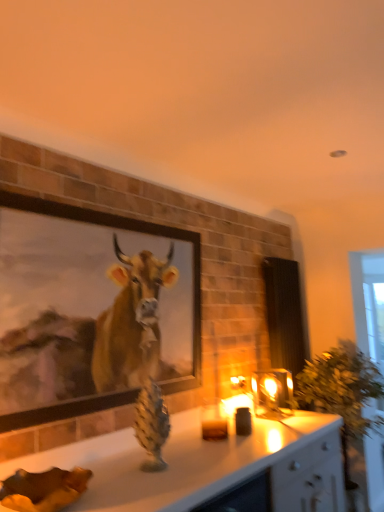
You are a GUI agent. You are given a task and a screenshot of the screen. Output one action in this format:
    pyautogui.click(x=<x>, y=<y>)
    Task: Click on the wooden framed painting at upper left
    The height and width of the screenshot is (512, 384).
    Given the screenshot: What is the action you would take?
    pyautogui.click(x=91, y=310)

Where is `green leafy plant at right`? This screenshot has height=512, width=384. green leafy plant at right is located at coordinates (342, 387).

Image resolution: width=384 pixels, height=512 pixels. What do you see at coordinates (342, 387) in the screenshot?
I see `green leafy plant at right` at bounding box center [342, 387].

This screenshot has height=512, width=384. Describe the element at coordinates (272, 392) in the screenshot. I see `translucent glass candle at center` at that location.

At what (x,y) coordinates should I click in order to perform the action: click on wooden framed painting at upper left. Please return your answer as a coordinate pair (x, y). This screenshot has height=512, width=384. Looking at the image, I should click on (91, 310).

From the image's perspective, would you say wooden framed painting at upper left is positioned over translucent glass candle at center?

Yes, from the image's perspective, wooden framed painting at upper left is on top of translucent glass candle at center.

Can you confirm if wooden framed painting at upper left is wider than translucent glass candle at center?

No.

Is wooden framed painting at upper left located outside translucent glass candle at center?

wooden framed painting at upper left lies outside translucent glass candle at center's area.

Which of these two, green leafy plant at right or translucent glass candle at center, stands shorter?

Standing shorter between the two is translucent glass candle at center.

Between green leafy plant at right and translucent glass candle at center, which one appears on the right side from the viewer's perspective?

From the viewer's perspective, green leafy plant at right appears more on the right side.

Is green leafy plant at right far away from translucent glass candle at center?

No, green leafy plant at right is not far from translucent glass candle at center.

From a real-world perspective, is green leafy plant at right over translucent glass candle at center?

No, from a real-world perspective, green leafy plant at right is not on top of translucent glass candle at center.

Is translucent glass candle at center inside or outside of green leafy plant at right?

translucent glass candle at center is not inside green leafy plant at right, it's outside.

You are a GUI agent. You are given a task and a screenshot of the screen. Output one action in this format:
    pyautogui.click(x=<x>, y=<y>)
    Task: Click on the candle holder that is above the green leafy plant at right (from a real-world perspective)
    
    Given the screenshot: What is the action you would take?
    pyautogui.click(x=272, y=392)

From the image's perspective, who appears lower, translucent glass candle at center or green leafy plant at right?

green leafy plant at right, from the image's perspective.

Is translucent glass candle at center positioned with its back to green leafy plant at right?

A: No, green leafy plant at right is not at the back of translucent glass candle at center.

Is point (316, 398) closer to camera compared to point (173, 288)?

No, it is behind (173, 288).

Is green leafy plant at right positioned far away from wooden framed painting at upper left?

Yes, green leafy plant at right and wooden framed painting at upper left are quite far apart.

Is green leafy plant at right inside or outside of wooden framed painting at upper left?

green leafy plant at right is located beyond the bounds of wooden framed painting at upper left.

Is green leafy plant at right closer to camera compared to wooden framed painting at upper left?

No, green leafy plant at right is further to the viewer.

Which object is further away from the camera taking this photo, translucent glass candle at center or wooden framed painting at upper left?

translucent glass candle at center is further away from the camera.

Which object is positioned more to the left, translucent glass candle at center or wooden framed painting at upper left?

wooden framed painting at upper left.

From the image's perspective, between translucent glass candle at center and wooden framed painting at upper left, which one is located above?

wooden framed painting at upper left.

Considering the positions of objects wooden framed painting at upper left and green leafy plant at right in the image provided, who is more to the left, wooden framed painting at upper left or green leafy plant at right?

Positioned to the left is wooden framed painting at upper left.

How distant is wooden framed painting at upper left from green leafy plant at right?

wooden framed painting at upper left and green leafy plant at right are 1.55 meters apart.

From the image's perspective, is wooden framed painting at upper left above or below green leafy plant at right?

Clearly, from the image's perspective, wooden framed painting at upper left is above green leafy plant at right.

Based on their sizes in the image, would you say wooden framed painting at upper left is bigger or smaller than green leafy plant at right?

Clearly, wooden framed painting at upper left is smaller in size than green leafy plant at right.

Find the location of a particular element. The image size is (384, 512). candle holder below the wooden framed painting at upper left (from a real-world perspective) is located at coordinates (272, 392).

You are a GUI agent. You are given a task and a screenshot of the screen. Output one action in this format:
    pyautogui.click(x=<x>, y=<y>)
    Task: Click on the plant located on the right of translucent glass candle at center
    This screenshot has width=384, height=512.
    Given the screenshot: What is the action you would take?
    pyautogui.click(x=342, y=387)

When comparing their distances from green leafy plant at right, does translucent glass candle at center or wooden framed painting at upper left seem closer?

The object closer to green leafy plant at right is translucent glass candle at center.

Looking at the image, which one is located closer to translucent glass candle at center, wooden framed painting at upper left or green leafy plant at right?

green leafy plant at right lies closer to translucent glass candle at center than the other object.

Considering their positions, is translucent glass candle at center positioned closer to wooden framed painting at upper left than green leafy plant at right?

Based on the image, translucent glass candle at center appears to be nearer to wooden framed painting at upper left.

When comparing their distances from green leafy plant at right, does wooden framed painting at upper left or translucent glass candle at center seem closer?

translucent glass candle at center lies closer to green leafy plant at right than the other object.

From the image, which object appears to be farther from wooden framed painting at upper left, green leafy plant at right or translucent glass candle at center?

green leafy plant at right.

Looking at the image, which one is located further to translucent glass candle at center, green leafy plant at right or wooden framed painting at upper left?

wooden framed painting at upper left is positioned further to the anchor translucent glass candle at center.

Locate an element on the screen. candle holder between wooden framed painting at upper left and green leafy plant at right is located at coordinates (272, 392).